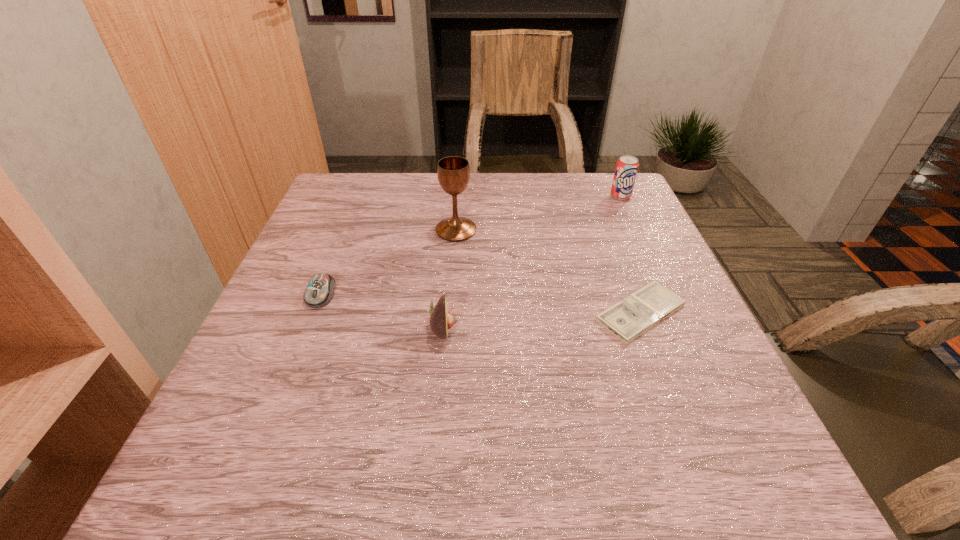
Locate an element on the screen. This screenshot has height=540, width=960. free spot between the computer mouse and the tallest object is located at coordinates (389, 262).

Where is `free spot between the shortest object and the fourth nearest object`? Image resolution: width=960 pixels, height=540 pixels. free spot between the shortest object and the fourth nearest object is located at coordinates point(548,271).

You are a GUI agent. You are given a task and a screenshot of the screen. Output one action in this format:
    pyautogui.click(x=<x>, y=<y>)
    Task: Click on the vacant area that lies between the dollar and the second shortest object
    The height and width of the screenshot is (540, 960).
    Given the screenshot: What is the action you would take?
    pyautogui.click(x=481, y=303)

You are a GUI agent. You are given a task and a screenshot of the screen. Output one action in this format:
    pyautogui.click(x=<x>, y=<y>)
    Task: Click on the object that ranks as the third closest to the avocado
    
    Given the screenshot: What is the action you would take?
    (634, 315)

Choose which object is the nearest neighbor to the leftmost object. Please provide its 2D coordinates. Your answer should be formatted as a tuple, i.e. [(x, y)], where the tuple contains the x and y coordinates of a point satisfying the conditions above.

[(441, 320)]

Where is `free region that satisfies the following two spatial constraints: 1. on the wheel side of the shortest object; 2. on the left side of the computer mouse`? This screenshot has height=540, width=960. free region that satisfies the following two spatial constraints: 1. on the wheel side of the shortest object; 2. on the left side of the computer mouse is located at coordinates (314, 313).